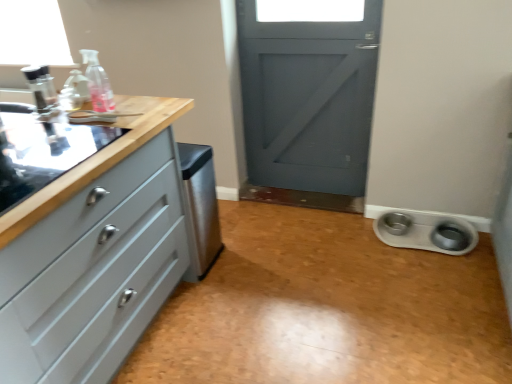
Where is `white glossy pet bowls at lower right`? white glossy pet bowls at lower right is located at coordinates (327, 309).

Looking at this image, measure the distance between white plastic pet bowls at lower right and camera.

A distance of 2.27 meters exists between white plastic pet bowls at lower right and camera.

This screenshot has width=512, height=384. What do you see at coordinates (94, 273) in the screenshot?
I see `matte gray chest of drawers at left` at bounding box center [94, 273].

Locate an element on the screen. black glass sink at left is located at coordinates (41, 143).

The image size is (512, 384). I want to click on sink above the matte gray chest of drawers at left (from a real-world perspective), so click(x=41, y=143).

Considering the relative positions of black glass sink at left and matte gray chest of drawers at left in the image provided, is black glass sink at left to the right of matte gray chest of drawers at left from the viewer's perspective?

Incorrect, black glass sink at left is not on the right side of matte gray chest of drawers at left.

Which of these two, black glass sink at left or matte gray chest of drawers at left, is smaller?

With smaller size is black glass sink at left.

Which of these two, black glass sink at left or matte gray chest of drawers at left, is wider?

Wider between the two is black glass sink at left.

From the image's perspective, is black glass sink at left on white plastic pet bowls at lower right?

Yes, from the image's perspective, black glass sink at left is over white plastic pet bowls at lower right.

Consider the image. Is the position of black glass sink at left more distant than that of white plastic pet bowls at lower right?

That is False.

Does black glass sink at left have a greater width compared to white plastic pet bowls at lower right?

Yes.

What's the angular difference between black glass sink at left and white plastic pet bowls at lower right's facing directions?

0.57 degrees.

Considering the sizes of white glossy pet bowls at lower right and satin stainless steel dishwasher at center in the image, is white glossy pet bowls at lower right bigger or smaller than satin stainless steel dishwasher at center?

Considering their sizes, white glossy pet bowls at lower right takes up more space than satin stainless steel dishwasher at center.

Does white glossy pet bowls at lower right contain satin stainless steel dishwasher at center?

Actually, satin stainless steel dishwasher at center is outside white glossy pet bowls at lower right.

Is point (274, 283) positioned in front of point (194, 176)?

That is False.

Locate an element on the screen. Image resolution: width=512 pixels, height=384 pixels. dish washer that is above the white glossy pet bowls at lower right (from the image's perspective) is located at coordinates (200, 207).

Which is in front, matte gray chest of drawers at left or white plastic pet bowls at lower right?

matte gray chest of drawers at left is more forward.

Does matte gray chest of drawers at left contain white plastic pet bowls at lower right?

No, white plastic pet bowls at lower right is not surrounded by matte gray chest of drawers at left.

How different are the orientations of matte gray chest of drawers at left and white plastic pet bowls at lower right in degrees?

They differ by 89.2 degrees in their facing directions.

In the image, is matte gray chest of drawers at left on the left side or the right side of white plastic pet bowls at lower right?

matte gray chest of drawers at left is to the left of white plastic pet bowls at lower right.

Does satin stainless steel dishwasher at center have a greater width compared to black glass sink at left?

Incorrect, the width of satin stainless steel dishwasher at center does not surpass that of black glass sink at left.

Based on the photo, from the image's perspective, is satin stainless steel dishwasher at center beneath black glass sink at left?

Indeed, from the image's perspective, satin stainless steel dishwasher at center is shown beneath black glass sink at left.

In order to click on sink above the satin stainless steel dishwasher at center (from a real-world perspective) in this screenshot , I will do `click(41, 143)`.

Is black glass sink at left at the back of satin stainless steel dishwasher at center?

Yes, satin stainless steel dishwasher at center's orientation is away from black glass sink at left.

From a real-world perspective, between white plastic pet bowls at lower right and white glossy pet bowls at lower right, who is vertically lower?

white glossy pet bowls at lower right.

Could you measure the distance between white plastic pet bowls at lower right and white glossy pet bowls at lower right?

A distance of 18.35 inches exists between white plastic pet bowls at lower right and white glossy pet bowls at lower right.

Is white plastic pet bowls at lower right inside the boundaries of white glossy pet bowls at lower right, or outside?

white plastic pet bowls at lower right is not enclosed by white glossy pet bowls at lower right.

From the image's perspective, which object appears higher, white plastic pet bowls at lower right or white glossy pet bowls at lower right?

white plastic pet bowls at lower right, from the image's perspective.

I want to click on bottle that is above the white glossy pet bowls at lower right (from the image's perspective), so click(97, 82).

Does point (264, 337) appear closer or farther from the camera than point (112, 103)?

Point (264, 337) appears to be farther away from the viewer than point (112, 103).

Considering the sizes of white glossy pet bowls at lower right and transparent plastic bottle at upper left in the image, is white glossy pet bowls at lower right bigger or smaller than transparent plastic bottle at upper left?

Clearly, white glossy pet bowls at lower right is larger in size than transparent plastic bottle at upper left.

Find the location of `chest of drawers lying on the right of black glass sink at left`. chest of drawers lying on the right of black glass sink at left is located at coordinates (94, 273).

The height and width of the screenshot is (384, 512). I want to click on sink located above the white plastic pet bowls at lower right (from the image's perspective), so click(41, 143).

Based on their spatial positions, is matte gray chest of drawers at left or transparent plastic bottle at upper left closer to black glass sink at left?

Based on the image, transparent plastic bottle at upper left appears to be nearer to black glass sink at left.

From the image, which object appears to be nearer to white plastic pet bowls at lower right, matte gray chest of drawers at left or satin stainless steel dishwasher at center?

satin stainless steel dishwasher at center is closer to white plastic pet bowls at lower right.

Considering their positions, is matte gray chest of drawers at left positioned closer to white glossy pet bowls at lower right than transparent plastic bottle at upper left?

matte gray chest of drawers at left.

Based on their spatial positions, is black glass sink at left or matte gray chest of drawers at left further from satin stainless steel dishwasher at center?

The object further to satin stainless steel dishwasher at center is black glass sink at left.

From the image, which object appears to be nearer to matte gray chest of drawers at left, white plastic pet bowls at lower right or transparent plastic bottle at upper left?

transparent plastic bottle at upper left is positioned closer to the anchor matte gray chest of drawers at left.

Estimate the real-world distances between objects in this image. Which object is further from white glossy pet bowls at lower right, black glass sink at left or satin stainless steel dishwasher at center?

black glass sink at left.

When comparing their distances from white plastic pet bowls at lower right, does black glass sink at left or transparent plastic bottle at upper left seem closer?

Based on the image, black glass sink at left appears to be nearer to white plastic pet bowls at lower right.

Which object lies nearer to the anchor point matte gray chest of drawers at left, white glossy pet bowls at lower right or white plastic pet bowls at lower right?

Based on the image, white glossy pet bowls at lower right appears to be nearer to matte gray chest of drawers at left.

Locate an element on the screen. The image size is (512, 384). dish washer situated between matte gray chest of drawers at left and white glossy pet bowls at lower right from left to right is located at coordinates (200, 207).

Identify the location of plain between black glass sink at left and white plastic pet bowls at lower right in the horizontal direction. (327, 309).

Identify the location of the chest of drawers located between black glass sink at left and white glossy pet bowls at lower right in the left-right direction. (94, 273).

Find the location of a particular element. dish washer between matte gray chest of drawers at left and white plastic pet bowls at lower right in the horizontal direction is located at coordinates (200, 207).